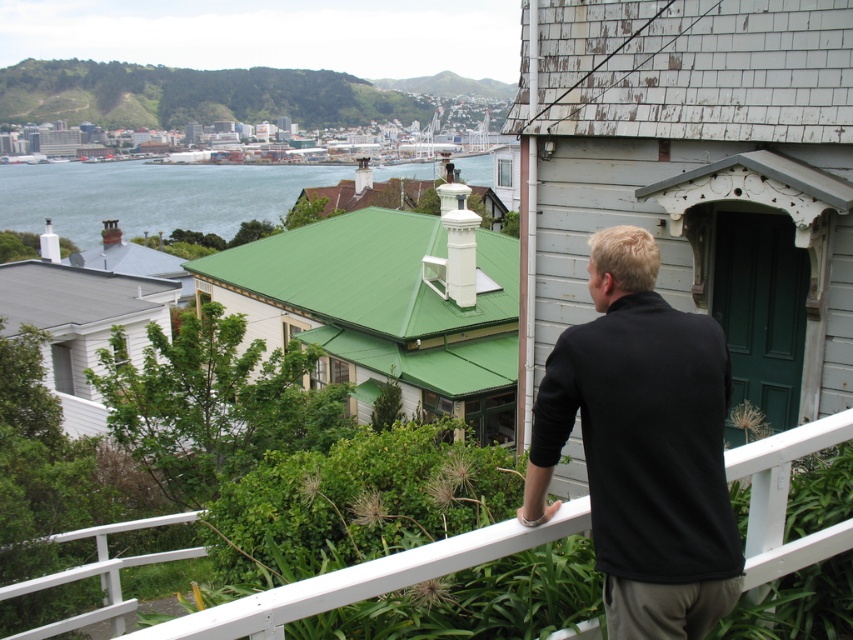
Question: Is white painted wood at upper center bigger than green water at upper left?

Choices:
 (A) no
 (B) yes

Answer: (A)

Question: Which point is farther to the camera?

Choices:
 (A) (77, 179)
 (B) (314, 612)

Answer: (A)

Question: Where is white painted wood at upper center located in relation to green water at upper left in the image?

Choices:
 (A) left
 (B) right

Answer: (B)

Question: Which of these objects is positioned farthest from the green water at upper left?

Choices:
 (A) white painted wood at upper center
 (B) black matte shirt at upper right

Answer: (A)

Question: Can you confirm if white painted wood at upper center is smaller than green water at upper left?

Choices:
 (A) yes
 (B) no

Answer: (A)

Question: Among these objects, which one is nearest to the camera?

Choices:
 (A) black matte shirt at upper right
 (B) green water at upper left
 (C) white painted wood at upper center

Answer: (A)